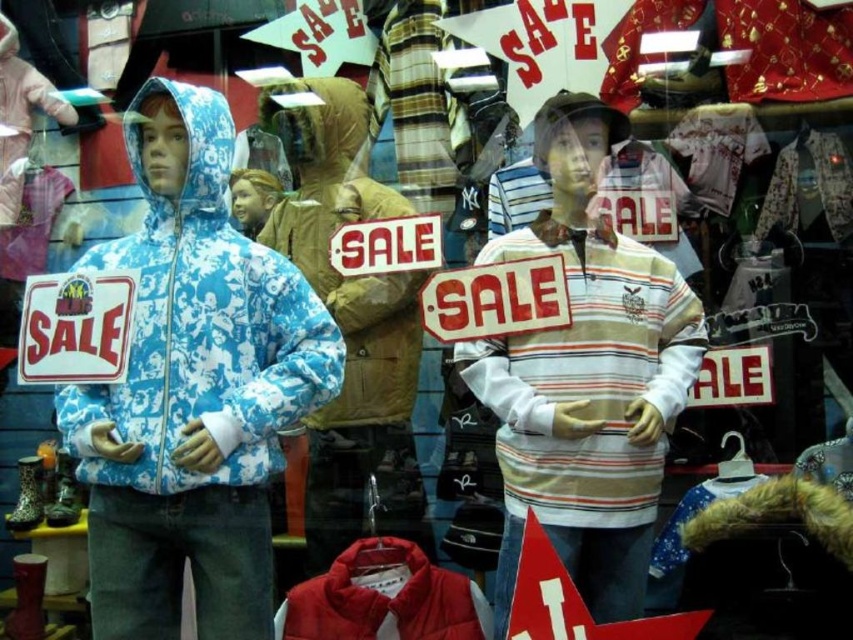
Question: Which point appears closest to the camera in this image?

Choices:
 (A) (505, 413)
 (B) (357, 404)
 (C) (456, 589)

Answer: (A)

Question: Which object appears farthest from the camera in this image?

Choices:
 (A) striped cotton shirt at center
 (B) brown fuzzy jacket at center
 (C) blue printed jacket at left
 (D) red down jacket at lower center

Answer: (B)

Question: Is blue printed jacket at left positioned behind brown fuzzy jacket at center?

Choices:
 (A) yes
 (B) no

Answer: (B)

Question: Observing the image, what is the correct spatial positioning of striped cotton shirt at center in reference to blue printed jacket at left?

Choices:
 (A) left
 (B) right

Answer: (B)

Question: Which point is closer to the camera?

Choices:
 (A) brown fuzzy jacket at center
 (B) red down jacket at lower center
 (C) striped cotton shirt at center
 (D) blue printed jacket at left

Answer: (D)

Question: Does striped cotton shirt at center have a greater width compared to red down jacket at lower center?

Choices:
 (A) no
 (B) yes

Answer: (B)